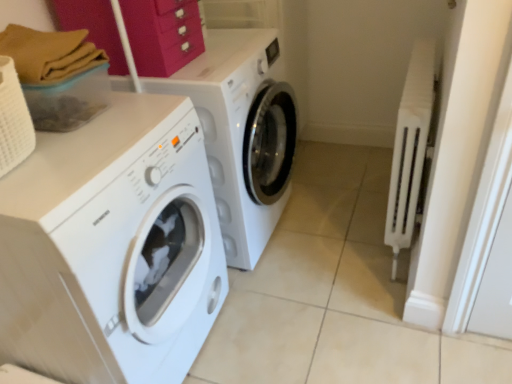
Identify the location of white glossy washing machine at left, which is counted as the 1th washing machine, starting from the front. The height and width of the screenshot is (384, 512). (112, 247).

Locate an element on the screen. The height and width of the screenshot is (384, 512). white glossy washing machine at center, positioned as the second washing machine in front-to-back order is located at coordinates (241, 133).

Is white plastic radiator at right touching white glossy washing machine at left, which is counted as the 1th washing machine, starting from the front?

No.

From the picture: Between white plastic radiator at right and white glossy washing machine at left, which is counted as the 1th washing machine, starting from the front, which one has more height?

Standing taller between the two is white glossy washing machine at left, which is counted as the 1th washing machine, starting from the front.

The image size is (512, 384). In the image, there is a white glossy washing machine at left, which is counted as the 1th washing machine, starting from the front. What are the coordinates of `radiator above it (from the image's perspective)` in the screenshot? It's located at pos(410,148).

Does point (394, 238) come closer to viewer compared to point (18, 247)?

No, (394, 238) is behind (18, 247).

Where is `washing machine behind the white plastic radiator at right`? The height and width of the screenshot is (384, 512). washing machine behind the white plastic radiator at right is located at coordinates (241, 133).

Is white glossy washing machine at center, positioned as the second washing machine in front-to-back order, oriented towards white plastic radiator at right?

Yes, white glossy washing machine at center, positioned as the second washing machine in front-to-back order, is oriented towards white plastic radiator at right.

From a real-world perspective, who is located lower, white glossy washing machine at center, the 1th washing machine positioned from the back, or white plastic radiator at right?

white plastic radiator at right, from a real-world perspective.

Is white plastic radiator at right far away from white glossy washing machine at center, the 1th washing machine positioned from the back?

That's not correct — white plastic radiator at right is a little close to white glossy washing machine at center, the 1th washing machine positioned from the back.

From a real-world perspective, relative to white glossy washing machine at center, positioned as the second washing machine in front-to-back order, is white plastic radiator at right vertically above or below?

white plastic radiator at right is below white glossy washing machine at center, positioned as the second washing machine in front-to-back order.

In terms of size, does white plastic radiator at right appear bigger or smaller than white glossy washing machine at center, the 1th washing machine positioned from the back?

white plastic radiator at right is smaller than white glossy washing machine at center, the 1th washing machine positioned from the back.

Is white glossy washing machine at left, the 2th washing machine positioned from the back, taller or shorter than white glossy washing machine at center, positioned as the second washing machine in front-to-back order?

In the image, white glossy washing machine at left, the 2th washing machine positioned from the back, appears to be taller than white glossy washing machine at center, positioned as the second washing machine in front-to-back order.

How different are the orientations of white glossy washing machine at left, which is counted as the 1th washing machine, starting from the front, and white glossy washing machine at center, positioned as the second washing machine in front-to-back order, in degrees?

The facing directions of white glossy washing machine at left, which is counted as the 1th washing machine, starting from the front, and white glossy washing machine at center, positioned as the second washing machine in front-to-back order, are 3.27e-05 degrees apart.

In the image, there is a white glossy washing machine at center, positioned as the second washing machine in front-to-back order. Where is `washing machine below it (from the image's perspective)`? This screenshot has width=512, height=384. washing machine below it (from the image's perspective) is located at coordinates (112, 247).

Which point is more distant from viewer, (14, 199) or (160, 89)?

The point (160, 89) is farther.

Is matte pink drawer at upper center looking in the opposite direction of white glossy washing machine at left, the 2th washing machine positioned from the back?

No, white glossy washing machine at left, the 2th washing machine positioned from the back, is not at the back of matte pink drawer at upper center.

Would you say matte pink drawer at upper center is inside or outside white glossy washing machine at left, the 2th washing machine positioned from the back?

matte pink drawer at upper center is spatially situated outside white glossy washing machine at left, the 2th washing machine positioned from the back.

Which object is wider, matte pink drawer at upper center or white glossy washing machine at left, the 2th washing machine positioned from the back?

white glossy washing machine at left, the 2th washing machine positioned from the back.

Are matte pink drawer at upper center and white glossy washing machine at left, which is counted as the 1th washing machine, starting from the front, beside each other?

matte pink drawer at upper center and white glossy washing machine at left, which is counted as the 1th washing machine, starting from the front, are not in contact.

Which is in front, white plastic radiator at right or matte pink drawer at upper center?

Positioned in front is matte pink drawer at upper center.

Which object is positioned more to the left, white plastic radiator at right or matte pink drawer at upper center?

From the viewer's perspective, matte pink drawer at upper center appears more on the left side.

The height and width of the screenshot is (384, 512). I want to click on drawer lying on the left of white plastic radiator at right, so click(162, 34).

Between white plastic radiator at right and matte pink drawer at upper center, which one has less height?

matte pink drawer at upper center.

How many degrees apart are the facing directions of white glossy washing machine at left, the 2th washing machine positioned from the back, and matte pink drawer at upper center?

They differ by 91.9 degrees in their facing directions.

Is point (105, 249) less distant than point (170, 16)?

That is True.

I want to click on drawer above the white glossy washing machine at left, the 2th washing machine positioned from the back (from the image's perspective), so click(x=162, y=34).

Is the position of white glossy washing machine at left, which is counted as the 1th washing machine, starting from the front, less distant than that of matte pink drawer at upper center?

Yes, it is.

Find the location of a particular element. radiator behind the white glossy washing machine at left, the 2th washing machine positioned from the back is located at coordinates (410, 148).

The height and width of the screenshot is (384, 512). Find the location of `radiator in front of the white glossy washing machine at center, the 1th washing machine positioned from the back`. radiator in front of the white glossy washing machine at center, the 1th washing machine positioned from the back is located at coordinates (410, 148).

Based on their spatial positions, is white glossy washing machine at center, the 1th washing machine positioned from the back, or white glossy washing machine at left, which is counted as the 1th washing machine, starting from the front, closer to white plastic radiator at right?

The object closer to white plastic radiator at right is white glossy washing machine at center, the 1th washing machine positioned from the back.

Estimate the real-world distances between objects in this image. Which object is closer to white plastic radiator at right, white glossy washing machine at center, the 1th washing machine positioned from the back, or matte pink drawer at upper center?

white glossy washing machine at center, the 1th washing machine positioned from the back.

Which object lies further to the anchor point white glossy washing machine at center, positioned as the second washing machine in front-to-back order, white plastic radiator at right or matte pink drawer at upper center?

white plastic radiator at right.

When comparing their distances from white glossy washing machine at center, the 1th washing machine positioned from the back, does matte pink drawer at upper center or white glossy washing machine at left, which is counted as the 1th washing machine, starting from the front, seem further?

white glossy washing machine at left, which is counted as the 1th washing machine, starting from the front, lies further to white glossy washing machine at center, the 1th washing machine positioned from the back, than the other object.

Looking at the image, which one is located further to white glossy washing machine at left, the 2th washing machine positioned from the back, white glossy washing machine at center, positioned as the second washing machine in front-to-back order, or matte pink drawer at upper center?

matte pink drawer at upper center.

Consider the image. From the image, which object appears to be farther from matte pink drawer at upper center, white glossy washing machine at left, which is counted as the 1th washing machine, starting from the front, or white plastic radiator at right?

white plastic radiator at right is positioned further to the anchor matte pink drawer at upper center.

Based on their spatial positions, is matte pink drawer at upper center or white glossy washing machine at left, the 2th washing machine positioned from the back, closer to white plastic radiator at right?

Among the two, matte pink drawer at upper center is located nearer to white plastic radiator at right.

In the scene shown: Estimate the real-world distances between objects in this image. Which object is closer to white glossy washing machine at left, which is counted as the 1th washing machine, starting from the front, matte pink drawer at upper center or white glossy washing machine at center, positioned as the second washing machine in front-to-back order?

The object closer to white glossy washing machine at left, which is counted as the 1th washing machine, starting from the front, is white glossy washing machine at center, positioned as the second washing machine in front-to-back order.

Where is `washing machine between matte pink drawer at upper center and white plastic radiator at right in the horizontal direction`? The height and width of the screenshot is (384, 512). washing machine between matte pink drawer at upper center and white plastic radiator at right in the horizontal direction is located at coordinates (241, 133).

At what (x,y) coordinates should I click in order to perform the action: click on washing machine between white glossy washing machine at left, the 2th washing machine positioned from the back, and white plastic radiator at right, in the horizontal direction. Please return your answer as a coordinate pair (x, y). The width and height of the screenshot is (512, 384). Looking at the image, I should click on (241, 133).

At what (x,y) coordinates should I click in order to perform the action: click on drawer located between white glossy washing machine at left, which is counted as the 1th washing machine, starting from the front, and white plastic radiator at right in the left-right direction. Please return your answer as a coordinate pair (x, y). Looking at the image, I should click on (x=162, y=34).

In order to click on washing machine between matte pink drawer at upper center and white glossy washing machine at left, the 2th washing machine positioned from the back, vertically in this screenshot , I will do `click(241, 133)`.